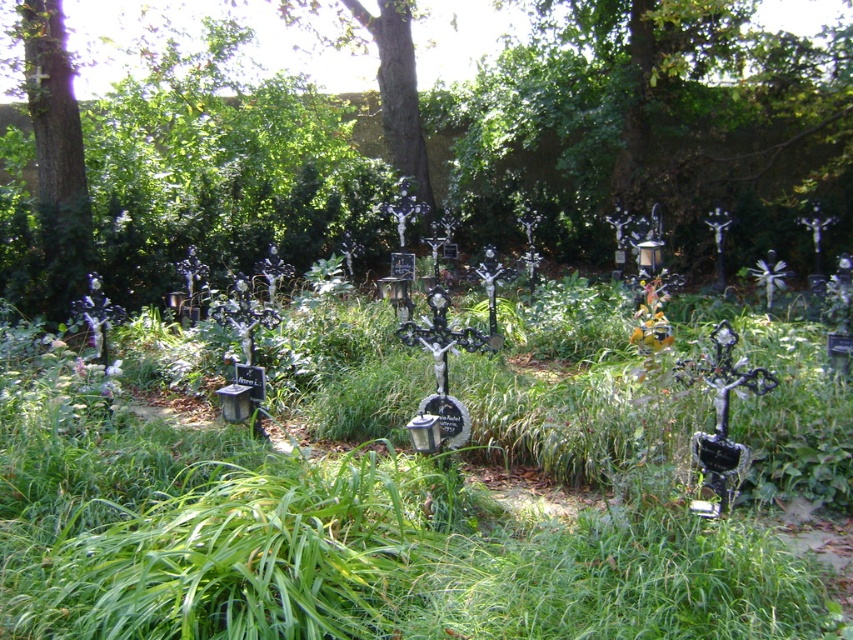
You are standing at the center of the cemetery and want to find the green leafy tree at center. According to the coordinates provided, where should you look relative to your current position?

The green leafy tree at center is located at coordinates point (x=451, y=145), which means it is positioned slightly to the left and forward from your current position at the center.

You are standing in the cemetery and notice two trees. The green leafy tree at center and the smooth bark tree at left. Which tree is closer to the left side of the scene?

The smooth bark tree at left is closer to the left side of the scene because the green leafy tree at center is positioned on the right side of it.